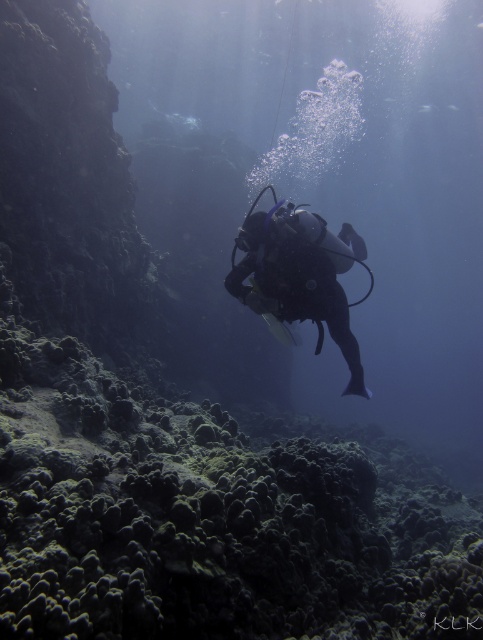
You are a marine biologist observing an underwater scene. You notice the green textured coral reef at center and the matte black scuba diver at center. Which object is shorter in height?

The green textured coral reef at center is shorter in height than the matte black scuba diver at center.

You are navigating an underwater drone to capture footage of the coral reef. The drone is currently at point A, which is point (0, 298), and needs to move to point B, which is point (278, 234). Considering the diver is between these two points, will the drone have an unobstructed path?

Point (0, 298) is in front of point (278, 234), so the diver is closer to the drone at point A. This means the drone will not have an unobstructed path to point B due to the diver being in between.